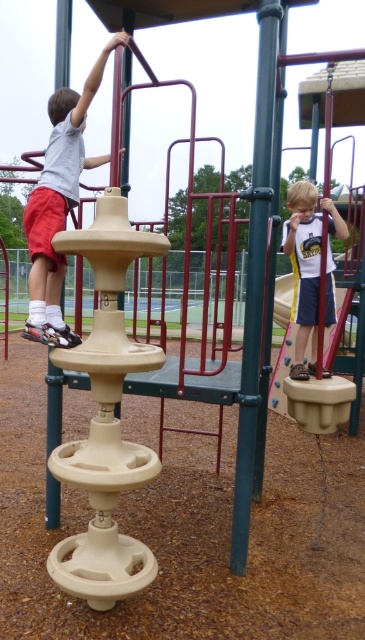
Question: Which object is the closest to the matte white shirt at lower right?

Choices:
 (A) matte beige climbing structure at left
 (B) beige plastic swing at right

Answer: (A)

Question: Which object appears closest to the camera in this image?

Choices:
 (A) beige plastic swing at right
 (B) matte white shirt at lower right

Answer: (B)

Question: Can you confirm if matte beige climbing structure at left is thinner than beige plastic swing at right?

Choices:
 (A) yes
 (B) no

Answer: (B)

Question: Is matte white shirt at lower right wider than beige plastic swing at right?

Choices:
 (A) no
 (B) yes

Answer: (B)

Question: Which point is closer to the camera taking this photo?

Choices:
 (A) (279, 401)
 (B) (66, 332)
 (C) (316, 192)

Answer: (B)

Question: Can you confirm if matte white shirt at lower right is positioned below beige plastic swing at right?

Choices:
 (A) yes
 (B) no

Answer: (B)